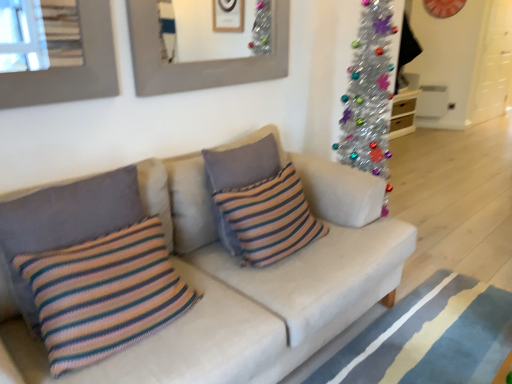
Question: Should I look upward or downward to see knitted multicolored pillow at left, the 2th pillow when ordered from back to front?

Choices:
 (A) up
 (B) down

Answer: (B)

Question: Is knitted striped pillow at center, arranged as the third pillow when viewed from the front, to the left of knitted striped pillow at center, the 1th pillow viewed from the front, from the viewer's perspective?

Choices:
 (A) yes
 (B) no

Answer: (B)

Question: Could you tell me if knitted striped pillow at center, arranged as the third pillow when viewed from the front, is turned towards knitted striped pillow at center, the 3th pillow from the back?

Choices:
 (A) no
 (B) yes

Answer: (A)

Question: Is the position of knitted striped pillow at center, marked as the first pillow in a back-to-front arrangement, more distant than that of knitted striped pillow at center, the 3th pillow from the back?

Choices:
 (A) yes
 (B) no

Answer: (A)

Question: From the image's perspective, is knitted striped pillow at center, arranged as the third pillow when viewed from the front, on knitted striped pillow at center, the 3th pillow from the back?

Choices:
 (A) yes
 (B) no

Answer: (A)

Question: Is knitted striped pillow at center, arranged as the third pillow when viewed from the front, smaller than knitted striped pillow at center, the 3th pillow from the back?

Choices:
 (A) yes
 (B) no

Answer: (A)

Question: From a real-world perspective, is knitted striped pillow at center, marked as the first pillow in a back-to-front arrangement, positioned over knitted striped pillow at center, the 3th pillow from the back, based on gravity?

Choices:
 (A) no
 (B) yes

Answer: (B)

Question: Is knitted multicolored pillow at left, positioned as the second pillow in front-to-back order, facing away from blue striped rug at lower right?

Choices:
 (A) yes
 (B) no

Answer: (B)

Question: From the image's perspective, is knitted multicolored pillow at left, the 2th pillow when ordered from back to front, located above blue striped rug at lower right?

Choices:
 (A) no
 (B) yes

Answer: (B)

Question: Considering the relative sizes of knitted multicolored pillow at left, the 2th pillow when ordered from back to front, and blue striped rug at lower right in the image provided, is knitted multicolored pillow at left, the 2th pillow when ordered from back to front, bigger than blue striped rug at lower right?

Choices:
 (A) yes
 (B) no

Answer: (B)

Question: Is the depth of knitted multicolored pillow at left, the 2th pillow when ordered from back to front, less than that of blue striped rug at lower right?

Choices:
 (A) no
 (B) yes

Answer: (B)

Question: Can you confirm if knitted multicolored pillow at left, positioned as the second pillow in front-to-back order, is positioned to the left of blue striped rug at lower right?

Choices:
 (A) yes
 (B) no

Answer: (A)

Question: Does knitted multicolored pillow at left, the 2th pillow when ordered from back to front, appear on the right side of blue striped rug at lower right?

Choices:
 (A) yes
 (B) no

Answer: (B)

Question: Can we say knitted striped pillow at center, marked as the first pillow in a back-to-front arrangement, lies outside matte gray picture frame at upper center?

Choices:
 (A) no
 (B) yes

Answer: (B)